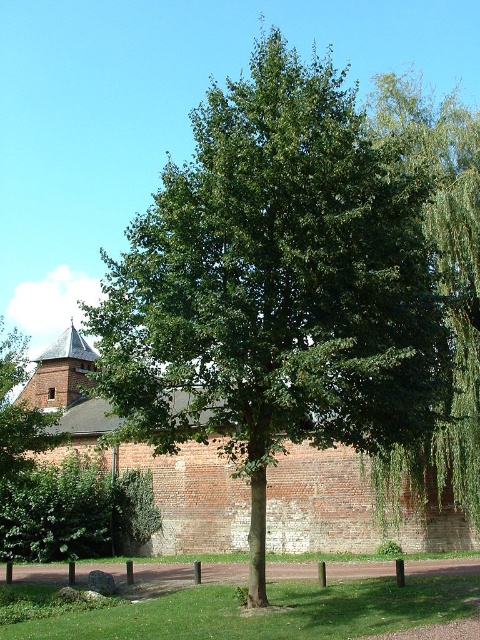
Question: Is green leafy willow at right to the left of green leafy tree at upper left from the viewer's perspective?

Choices:
 (A) yes
 (B) no

Answer: (B)

Question: Is green leafy hedge at center wider than green leafy tree at upper left?

Choices:
 (A) yes
 (B) no

Answer: (B)

Question: Which object is closer to the camera taking this photo?

Choices:
 (A) green leafy tree at center
 (B) green leafy hedge at center
 (C) green leafy tree at upper left
 (D) green leafy willow at right

Answer: (A)

Question: Which of the following is the farthest from the observer?

Choices:
 (A) green leafy tree at upper left
 (B) green leafy hedge at center
 (C) green leafy willow at right

Answer: (B)

Question: Which object appears farthest from the camera in this image?

Choices:
 (A) green leafy willow at right
 (B) green leafy tree at upper left

Answer: (B)

Question: Is green leafy willow at right to the left of green leafy hedge at center from the viewer's perspective?

Choices:
 (A) no
 (B) yes

Answer: (A)